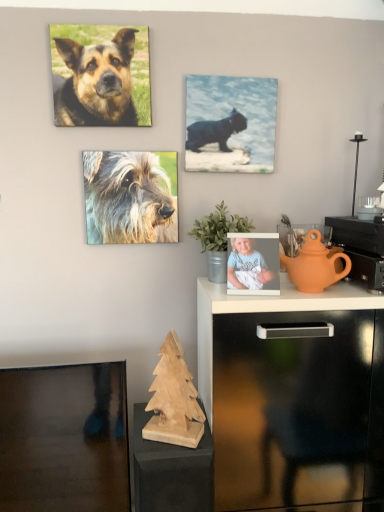
Question: Considering the relative sizes of orange clay teapot at right and fuzzy fur dog at center, which ranks as the first dog in bottom-to-top order, in the image provided, is orange clay teapot at right thinner than fuzzy fur dog at center, which ranks as the first dog in bottom-to-top order,?

Choices:
 (A) no
 (B) yes

Answer: (A)

Question: From the image's perspective, is orange clay teapot at right above fuzzy fur dog at center, which ranks as the second dog in top-to-bottom order?

Choices:
 (A) no
 (B) yes

Answer: (A)

Question: Considering the relative positions of orange clay teapot at right and fuzzy fur dog at center, which ranks as the second dog in top-to-bottom order, in the image provided, is orange clay teapot at right in front of fuzzy fur dog at center, which ranks as the second dog in top-to-bottom order,?

Choices:
 (A) no
 (B) yes

Answer: (B)

Question: Is fuzzy fur dog at center, which ranks as the second dog in top-to-bottom order, at the back of orange clay teapot at right?

Choices:
 (A) yes
 (B) no

Answer: (B)

Question: Are orange clay teapot at right and fuzzy fur dog at center, which ranks as the first dog in bottom-to-top order, making contact?

Choices:
 (A) yes
 (B) no

Answer: (B)

Question: Is fuzzy fur dog at center, which ranks as the first dog in bottom-to-top order, taller or shorter than green matte plant at center?

Choices:
 (A) short
 (B) tall

Answer: (B)

Question: Does point (94, 228) appear closer or farther from the camera than point (198, 225)?

Choices:
 (A) farther
 (B) closer

Answer: (A)

Question: From the image's perspective, is fuzzy fur dog at center, which ranks as the second dog in top-to-bottom order, above or below green matte plant at center?

Choices:
 (A) below
 (B) above

Answer: (B)

Question: Relative to green matte plant at center, is fuzzy fur dog at center, which ranks as the second dog in top-to-bottom order, in front or behind?

Choices:
 (A) behind
 (B) front

Answer: (A)

Question: From a real-world perspective, is black glossy cat at upper center above or below fuzzy fur dog at center, which ranks as the first dog in bottom-to-top order?

Choices:
 (A) below
 (B) above

Answer: (B)

Question: Considering their positions, is black glossy cat at upper center located in front of or behind fuzzy fur dog at center, which ranks as the first dog in bottom-to-top order?

Choices:
 (A) behind
 (B) front

Answer: (A)

Question: Considering the relative positions of black glossy cat at upper center and fuzzy fur dog at center, which ranks as the first dog in bottom-to-top order, in the image provided, is black glossy cat at upper center to the left or to the right of fuzzy fur dog at center, which ranks as the first dog in bottom-to-top order,?

Choices:
 (A) left
 (B) right

Answer: (B)

Question: Is black glossy cat at upper center bigger or smaller than fuzzy fur dog at center, which ranks as the second dog in top-to-bottom order?

Choices:
 (A) big
 (B) small

Answer: (A)

Question: From the image's perspective, is black glossy cat at upper center located above or below wooden christmas tree at lower center?

Choices:
 (A) below
 (B) above

Answer: (B)

Question: Would you say black glossy cat at upper center is to the left or to the right of wooden christmas tree at lower center in the picture?

Choices:
 (A) right
 (B) left

Answer: (A)